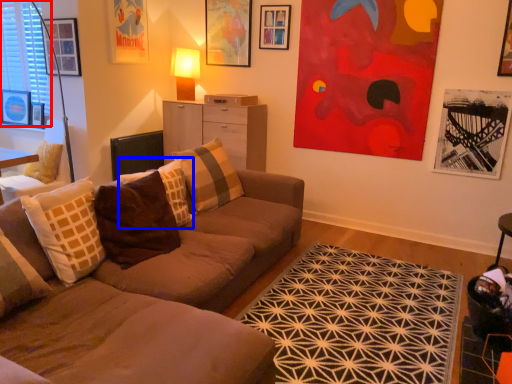
Question: Among these objects, which one is farthest to the camera, window (highlighted by a red box) or pillow (highlighted by a blue box)?

Choices:
 (A) window
 (B) pillow

Answer: (A)